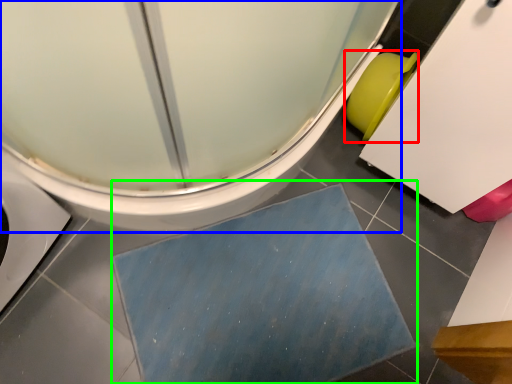
Question: Which object is the farthest from toilet bowl (highlighted by a red box)? Choose among these: toilet (highlighted by a blue box) or bath mat (highlighted by a green box).

Choices:
 (A) toilet
 (B) bath mat

Answer: (B)